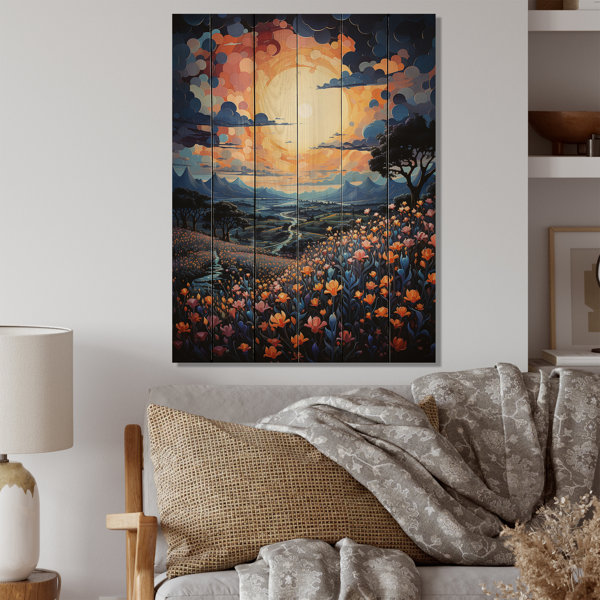
At what (x,y) coordinates should I click in order to perform the action: click on shelves inner back wall. Please return your answer as a coordinate pair (x, y). Looking at the image, I should click on (542, 328), (555, 97), (559, 67).